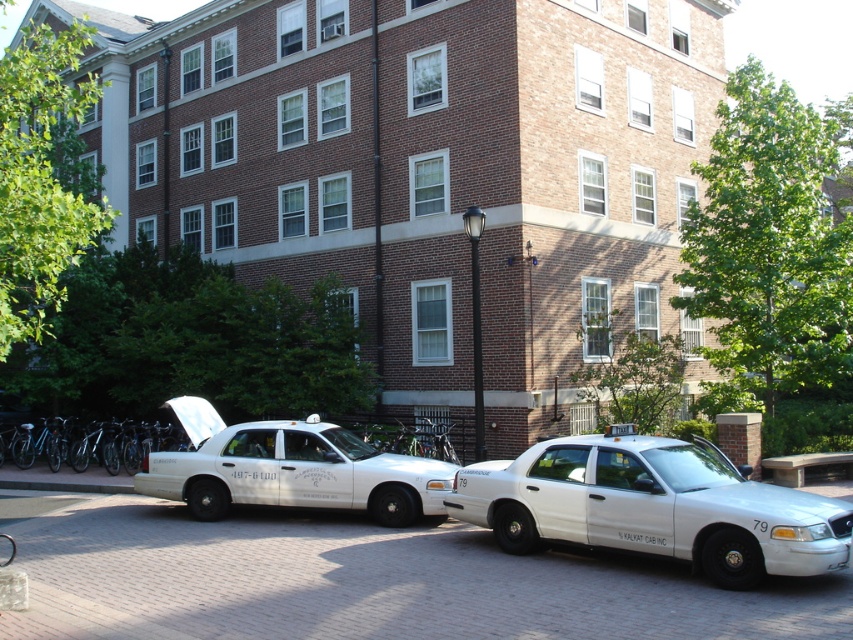
Question: Which object appears farthest from the camera in this image?

Choices:
 (A) white glossy sedan at center
 (B) white glossy taxi at center

Answer: (B)

Question: Which object is farther from the camera taking this photo?

Choices:
 (A) white glossy sedan at center
 (B) white brick pavement at center
 (C) white glossy taxi at center

Answer: (C)

Question: Does white brick pavement at center appear over white glossy taxi at center?

Choices:
 (A) yes
 (B) no

Answer: (B)

Question: Does white brick pavement at center lie behind white glossy sedan at center?

Choices:
 (A) no
 (B) yes

Answer: (A)

Question: Which point is farther to the camera?

Choices:
 (A) click(439, 490)
 (B) click(310, 612)

Answer: (A)

Question: Does white glossy sedan at center appear over white glossy taxi at center?

Choices:
 (A) yes
 (B) no

Answer: (A)